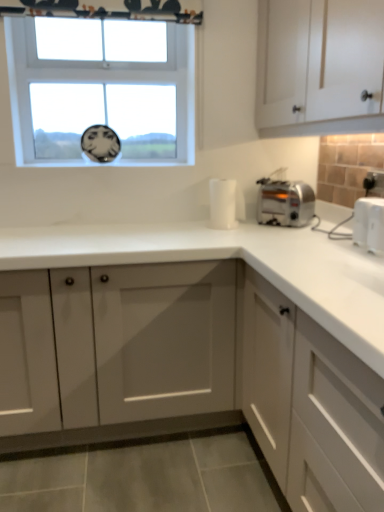
Question: From the image's perspective, is white plastic toaster at right above or below white matte cabinet at lower right, which is the 1th cabinetry from bottom to top?

Choices:
 (A) above
 (B) below

Answer: (A)

Question: From their relative heights in the image, would you say white plastic toaster at right is taller or shorter than white matte cabinet at lower right, the third cabinetry when ordered from top to bottom?

Choices:
 (A) short
 (B) tall

Answer: (A)

Question: Based on their relative distances, which object is nearer to the white matte cabinet at lower right, the third cabinetry when ordered from top to bottom?

Choices:
 (A) clear glass window at upper center
 (B) white plastic toaster at right
 (C) white plastic electric outlet at upper right
 (D) satin silver toaster at right
 (E) white matte cabinet at center, which is counted as the second cabinetry, starting from the top

Answer: (E)

Question: Based on their relative distances, which object is nearer to the white matte cabinet at upper right, the 3th cabinetry in the bottom-to-top sequence?

Choices:
 (A) white matte cabinet at lower right, which is the 1th cabinetry from bottom to top
 (B) white plastic electric outlet at upper right
 (C) white matte cabinet at center, which is counted as the second cabinetry, starting from the top
 (D) satin silver toaster at right
 (E) clear glass window at upper center

Answer: (D)